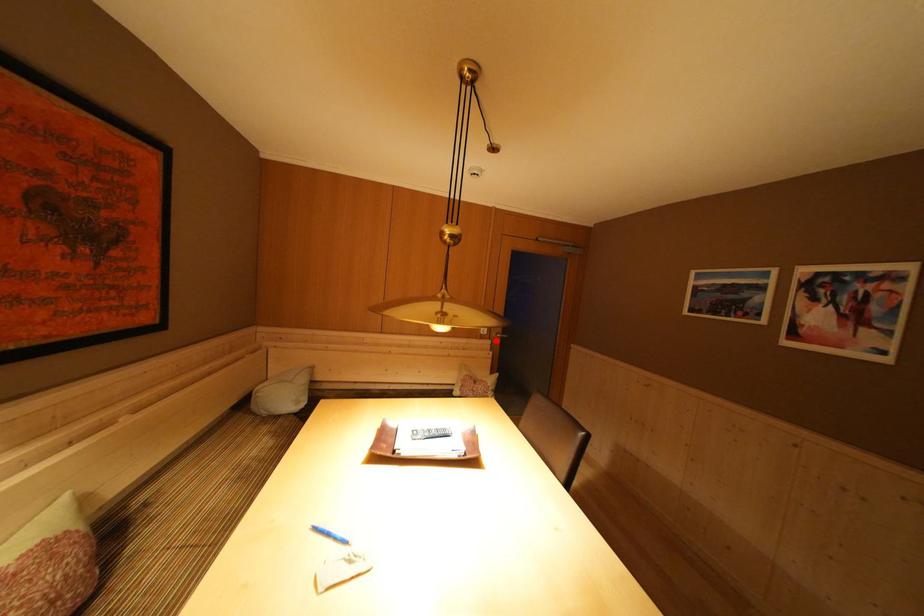
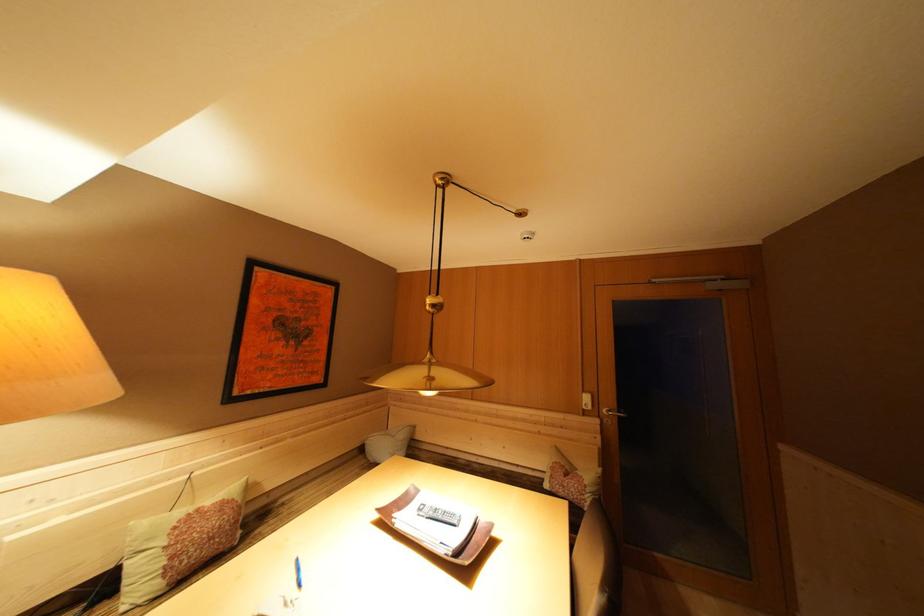
The point at the highlighted location is marked in the first image. Where is the corresponding point in the second image?

(602, 418)